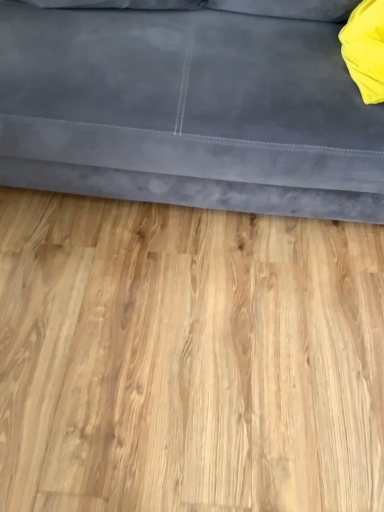
What is the approximate width of light wood flooring at center?

It is 1.34 meters.

You are a GUI agent. You are given a task and a screenshot of the screen. Output one action in this format:
    pyautogui.click(x=<x>, y=<y>)
    Task: Click on the suede gray couch at upper center
    This screenshot has width=384, height=512.
    Given the screenshot: What is the action you would take?
    pyautogui.click(x=188, y=111)

From the image's perspective, is yellow fabric pillow at upper right above light wood flooring at center?

Yes, from the image's perspective, yellow fabric pillow at upper right is on top of light wood flooring at center.

Which object is closer to the camera taking this photo, yellow fabric pillow at upper right or light wood flooring at center?

light wood flooring at center is more forward.

The width and height of the screenshot is (384, 512). I want to click on studio couch lying in front of the yellow fabric pillow at upper right, so click(x=188, y=111).

In terms of height, does yellow fabric pillow at upper right look taller or shorter compared to suede gray couch at upper center?

yellow fabric pillow at upper right is shorter than suede gray couch at upper center.

Which is correct: yellow fabric pillow at upper right is inside suede gray couch at upper center, or outside of it?

yellow fabric pillow at upper right is located inside suede gray couch at upper center.

Is yellow fabric pillow at upper right facing towards suede gray couch at upper center?

Yes, yellow fabric pillow at upper right faces towards suede gray couch at upper center.

Looking at their sizes, would you say suede gray couch at upper center is wider or thinner than light wood flooring at center?

Clearly, suede gray couch at upper center has less width compared to light wood flooring at center.

Is suede gray couch at upper center at the left side of light wood flooring at center?

In fact, suede gray couch at upper center is to the right of light wood flooring at center.

In order to click on hardwood directly beneath the suede gray couch at upper center (from a real-world perspective) in this screenshot , I will do `click(187, 358)`.

Looking at this image, considering the relative positions of suede gray couch at upper center and light wood flooring at center in the image provided, is suede gray couch at upper center in front of light wood flooring at center?

Yes, it is in front of light wood flooring at center.

Can you tell me how much suede gray couch at upper center and yellow fabric pillow at upper right differ in facing direction?

The facing directions of suede gray couch at upper center and yellow fabric pillow at upper right are 0.603 degrees apart.

Does suede gray couch at upper center have a lesser width compared to yellow fabric pillow at upper right?

No, suede gray couch at upper center is not thinner than yellow fabric pillow at upper right.

Based on their positions, is suede gray couch at upper center located to the left or right of yellow fabric pillow at upper right?

Clearly, suede gray couch at upper center is on the left of yellow fabric pillow at upper right in the image.

Looking at the image, does suede gray couch at upper center seem bigger or smaller compared to yellow fabric pillow at upper right?

Considering their sizes, suede gray couch at upper center takes up more space than yellow fabric pillow at upper right.

This screenshot has height=512, width=384. What are the coordinates of `pillow to the right of light wood flooring at center` in the screenshot? It's located at (365, 49).

Is light wood flooring at center oriented away from yellow fabric pillow at upper right?

No.

What's the angular difference between light wood flooring at center and yellow fabric pillow at upper right's facing directions?

There is a 89.4-degree angle between the facing directions of light wood flooring at center and yellow fabric pillow at upper right.

From the picture: Can you confirm if light wood flooring at center is bigger than yellow fabric pillow at upper right?

Yes, light wood flooring at center is bigger than yellow fabric pillow at upper right.

Considering the relative positions of light wood flooring at center and suede gray couch at upper center in the image provided, is light wood flooring at center to the right of suede gray couch at upper center from the viewer's perspective?

No, light wood flooring at center is not to the right of suede gray couch at upper center.

Where is `hardwood on the left of suede gray couch at upper center`? This screenshot has width=384, height=512. hardwood on the left of suede gray couch at upper center is located at coordinates (187, 358).

From a real-world perspective, between light wood flooring at center and suede gray couch at upper center, who is vertically lower?

light wood flooring at center.

Who is taller, light wood flooring at center or suede gray couch at upper center?

With more height is suede gray couch at upper center.

Find the location of `pillow behind the light wood flooring at center`. pillow behind the light wood flooring at center is located at coordinates (365, 49).

Locate an element on the screen. studio couch on the left of yellow fabric pillow at upper right is located at coordinates pos(188,111).

Looking at the image, which one is located closer to yellow fabric pillow at upper right, suede gray couch at upper center or light wood flooring at center?

The object closer to yellow fabric pillow at upper right is suede gray couch at upper center.

From the image, which object appears to be farther from light wood flooring at center, yellow fabric pillow at upper right or suede gray couch at upper center?

yellow fabric pillow at upper right lies further to light wood flooring at center than the other object.

Based on the photo, based on their spatial positions, is yellow fabric pillow at upper right or light wood flooring at center further from suede gray couch at upper center?

The object further to suede gray couch at upper center is light wood flooring at center.

Looking at the image, which one is located closer to suede gray couch at upper center, light wood flooring at center or yellow fabric pillow at upper right?

yellow fabric pillow at upper right is positioned closer to the anchor suede gray couch at upper center.

Which object lies further to the anchor point light wood flooring at center, suede gray couch at upper center or yellow fabric pillow at upper right?

The object further to light wood flooring at center is yellow fabric pillow at upper right.

When comparing their distances from yellow fabric pillow at upper right, does light wood flooring at center or suede gray couch at upper center seem further?

Among the two, light wood flooring at center is located further to yellow fabric pillow at upper right.

I want to click on pillow between suede gray couch at upper center and light wood flooring at center vertically, so click(365, 49).